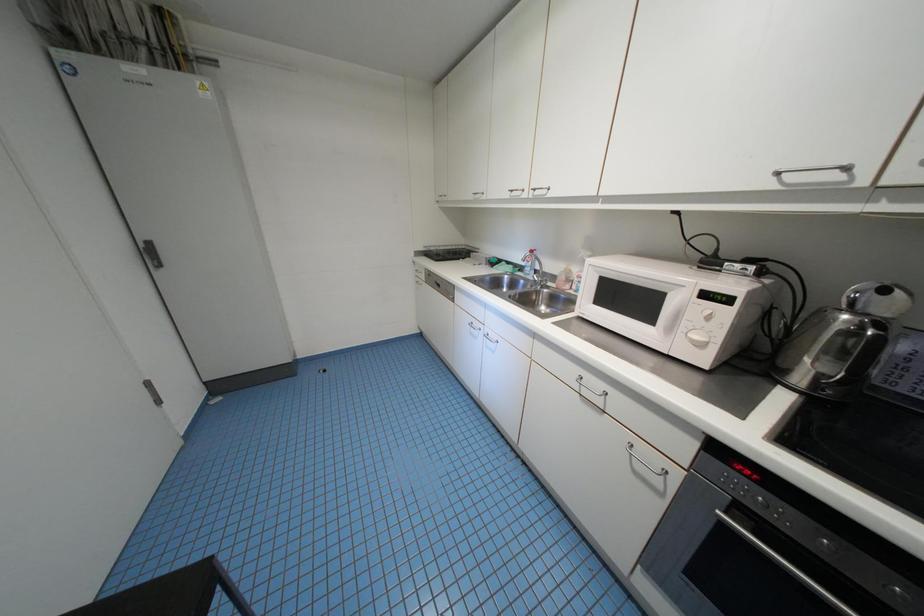
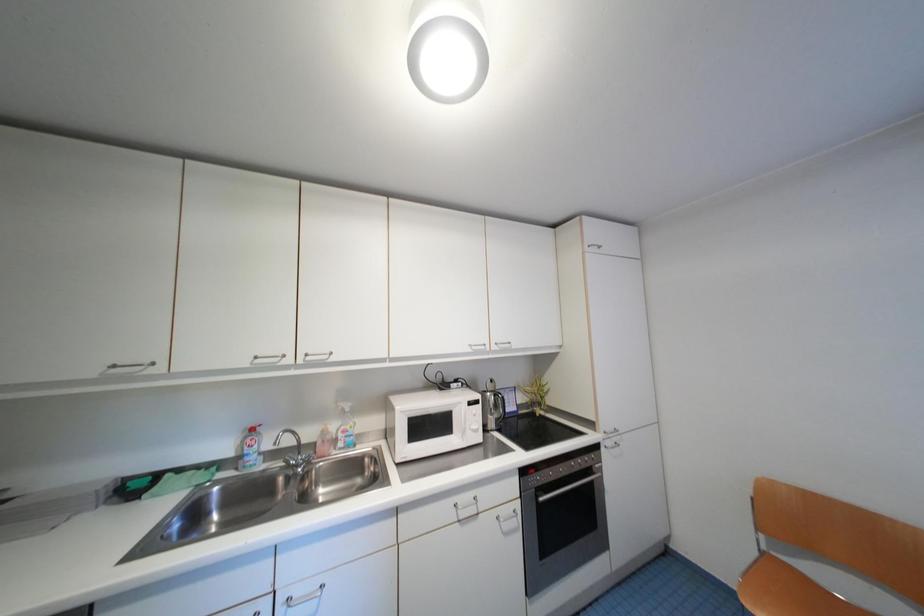
Question: The camera is either moving clockwise (left) or counter-clockwise (right) around the object. The first image is from the beginning of the video and the second image is from the end. Is the camera moving left or right when shooting the video?

Choices:
 (A) Left
 (B) Right

Answer: (A)